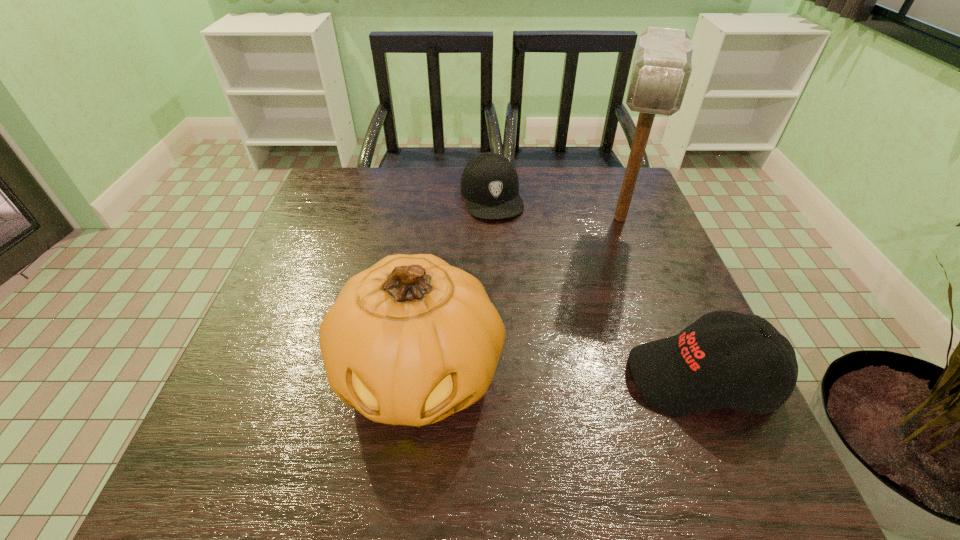
Where is `free space on the desktop that is between the pumpkin and the third tallest object and is positioned on the striking face of the tallest object`? The image size is (960, 540). free space on the desktop that is between the pumpkin and the third tallest object and is positioned on the striking face of the tallest object is located at coordinates (595, 377).

The image size is (960, 540). Find the location of `vacant spot on the desktop that is between the pumpkin and the baseball cap and is positioned on the front-facing side of the shortest object`. vacant spot on the desktop that is between the pumpkin and the baseball cap and is positioned on the front-facing side of the shortest object is located at coordinates (547, 376).